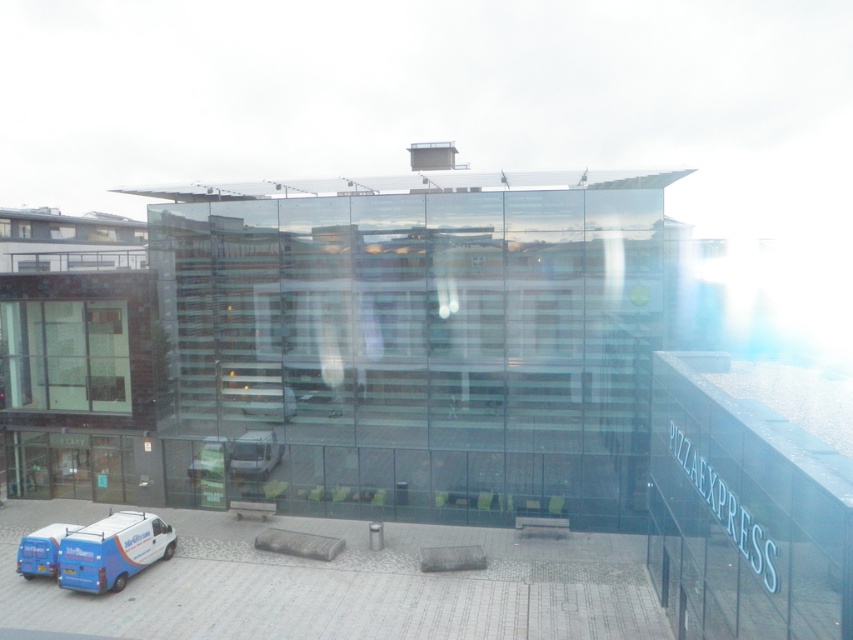
Question: Does white matte van at center appear on the left side of blue metallic van at center?

Choices:
 (A) no
 (B) yes

Answer: (B)

Question: Is white matte van at center closer to camera compared to blue metallic van at center?

Choices:
 (A) yes
 (B) no

Answer: (B)

Question: Where is white matte van at center located in relation to blue metallic van at center in the image?

Choices:
 (A) below
 (B) above

Answer: (A)

Question: Which point appears closest to the camera in this image?

Choices:
 (A) (241, 444)
 (B) (332, 404)

Answer: (B)